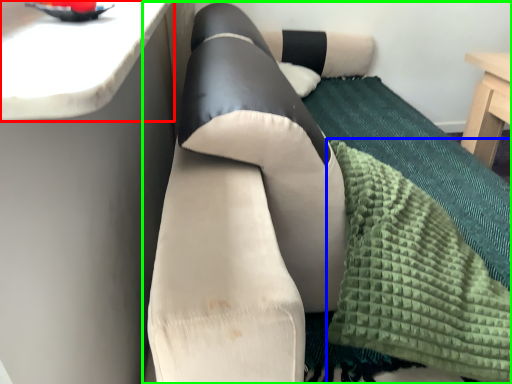
Question: Estimate the real-world distances between objects in this image. Which object is farther from counter top (highlighted by a red box), blanket (highlighted by a blue box) or studio couch (highlighted by a green box)?

Choices:
 (A) blanket
 (B) studio couch

Answer: (A)